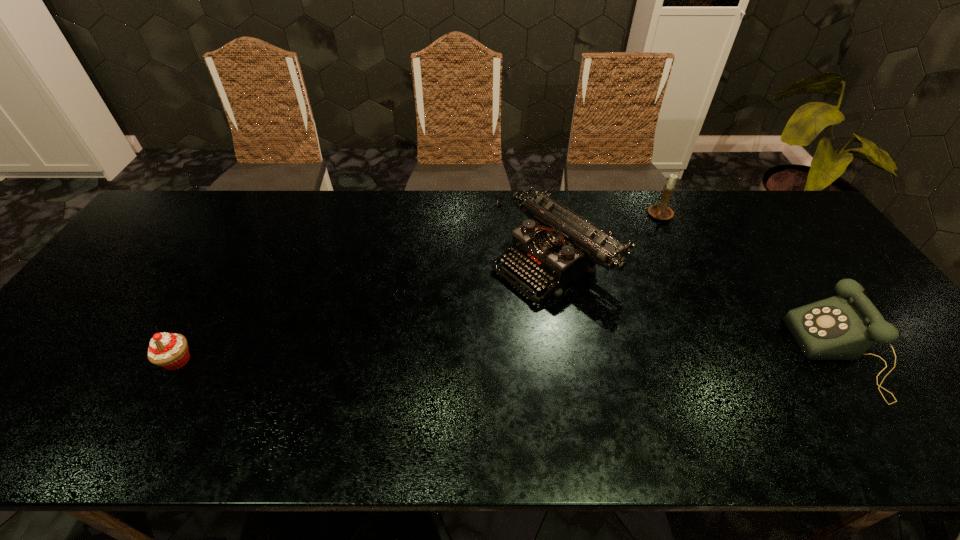
The height and width of the screenshot is (540, 960). What are the coordinates of `object at the right edge` in the screenshot? It's located at (843, 327).

Locate an element on the screen. object situated at the near right corner is located at coordinates (843, 327).

Image resolution: width=960 pixels, height=540 pixels. I want to click on vacant space at the far edge of the desktop, so (361, 215).

Where is `free space at the near edge of the desktop`? Image resolution: width=960 pixels, height=540 pixels. free space at the near edge of the desktop is located at coordinates (200, 383).

Find the location of a particular element. vacant point at the far right corner is located at coordinates (783, 210).

Locate an element on the screen. This screenshot has height=540, width=960. vacant region between the third tallest object and the second object from right to left is located at coordinates (750, 285).

Identify the location of empty location between the shortest object and the third object from left to right. (419, 288).

The width and height of the screenshot is (960, 540). I want to click on free space between the typewriter and the rightmost object, so click(697, 308).

Find the location of `unoccupied area between the second shortest object and the leftmost object`. unoccupied area between the second shortest object and the leftmost object is located at coordinates (509, 357).

The image size is (960, 540). I want to click on free space between the third object from right to left and the third tallest object, so click(697, 308).